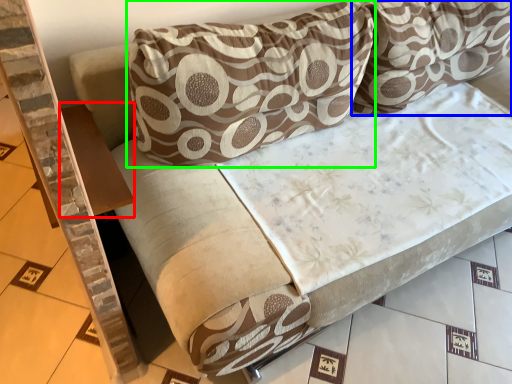
Question: Which is nearer to the table (highlighted by a red box)? pillow (highlighted by a blue box) or pillow (highlighted by a green box).

Choices:
 (A) pillow
 (B) pillow

Answer: (B)